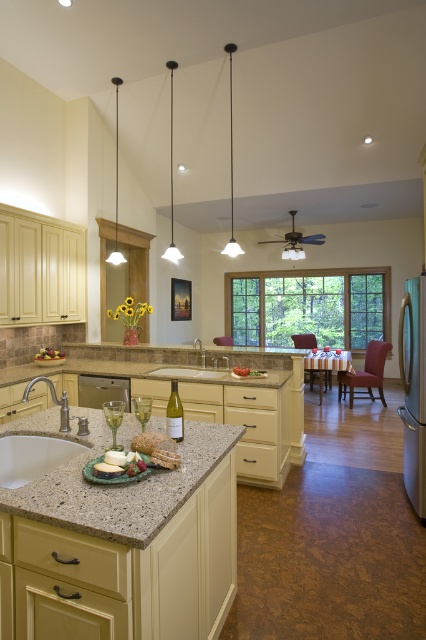
Question: Considering the real-world distances, which object is closest to the white granite sink at center?

Choices:
 (A) satin stainless steel refrigerator at right
 (B) granite/textured counter top at center

Answer: (A)

Question: Which object is farther from the camera taking this photo?

Choices:
 (A) satin nickel dishwasher at center
 (B) satin stainless steel refrigerator at right
 (C) white granite sink at center

Answer: (A)

Question: Estimate the real-world distances between objects in this image. Which object is closer to the satin nickel dishwasher at center?

Choices:
 (A) granite/textured counter top at center
 (B) white granite sink at center
 (C) satin stainless steel refrigerator at right

Answer: (B)

Question: Is satin nickel dishwasher at center positioned in front of brown leather chair at center?

Choices:
 (A) yes
 (B) no

Answer: (A)

Question: Observing the image, what is the correct spatial positioning of satin nickel dishwasher at center in reference to wooden chair at center?

Choices:
 (A) above
 (B) below

Answer: (B)

Question: Is the position of satin nickel dishwasher at center more distant than that of wooden chair at center?

Choices:
 (A) yes
 (B) no

Answer: (B)